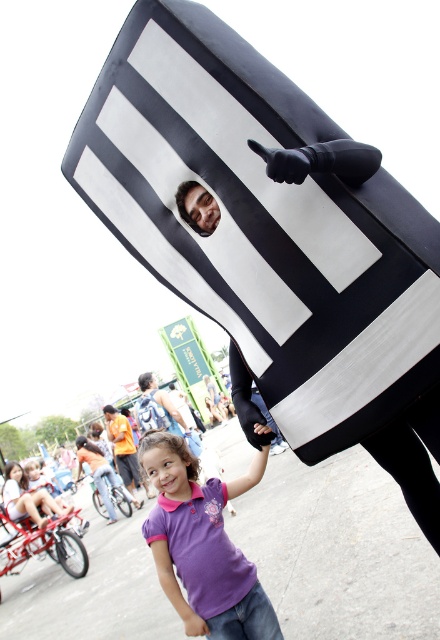
Question: Estimate the real-world distances between objects in this image. Which object is closer to the black matte flag at upper center?

Choices:
 (A) orange fabric shirt at lower left
 (B) purple cotton shirt at center
 (C) smooth skin face at upper center
 (D) brushed metal backpack at lower center

Answer: (C)

Question: Is black matte flag at upper center below purple cotton shirt at center?

Choices:
 (A) yes
 (B) no

Answer: (B)

Question: Among these objects, which one is nearest to the camera?

Choices:
 (A) smooth skin face at upper center
 (B) black matte flag at upper center
 (C) orange fabric shirt at lower left
 (D) purple cotton shirt at center

Answer: (B)

Question: Is purple cotton shirt at center positioned at the back of orange fabric shirt at lower left?

Choices:
 (A) no
 (B) yes

Answer: (A)

Question: Estimate the real-world distances between objects in this image. Which object is farther from the brushed metal backpack at lower center?

Choices:
 (A) black matte flag at upper center
 (B) orange fabric shirt at lower left

Answer: (A)

Question: Observing the image, what is the correct spatial positioning of brushed metal backpack at lower center in reference to orange fabric shirt at lower left?

Choices:
 (A) below
 (B) above

Answer: (B)